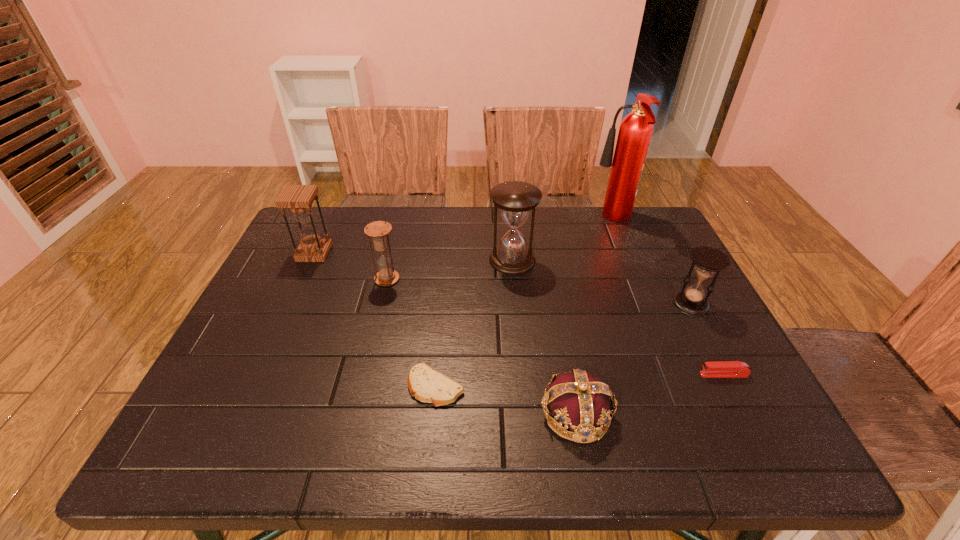
Identify the location of pita bread. Image resolution: width=960 pixels, height=540 pixels. (427, 385).

Find the location of a particular element. vacant area located 0.240m at the nozzle of the farthest object is located at coordinates (517, 220).

Locate an element on the screen. This screenshot has height=540, width=960. vacant space located at the nozzle of the farthest object is located at coordinates (470, 220).

You are a GUI agent. You are given a task and a screenshot of the screen. Output one action in this format:
    pyautogui.click(x=<x>, y=<y>)
    Task: Click on the vacant position located 0.270m at the nozzle of the farthest object
    This screenshot has height=540, width=960.
    Given the screenshot: What is the action you would take?
    pyautogui.click(x=508, y=220)

At what (x,y) coordinates should I click in order to perform the action: click on blank area located 0.080m on the left of the second hourglass from right to left. Please return your answer as a coordinate pair (x, y). This screenshot has width=960, height=540. Looking at the image, I should click on (461, 260).

I want to click on free space located 0.150m on the right of the leftmost object, so click(x=381, y=253).

Where is `free space located 0.180m on the right of the third hourglass from right to left`? This screenshot has height=540, width=960. free space located 0.180m on the right of the third hourglass from right to left is located at coordinates (467, 279).

Where is `free space located on the left of the nearest hourglass`? Image resolution: width=960 pixels, height=540 pixels. free space located on the left of the nearest hourglass is located at coordinates (539, 304).

In order to click on vacant space located 0.370m on the back of the third shortest object in this screenshot , I will do `click(550, 271)`.

The height and width of the screenshot is (540, 960). Identify the location of vacant space located 0.220m on the front-facing side of the stapler. (598, 374).